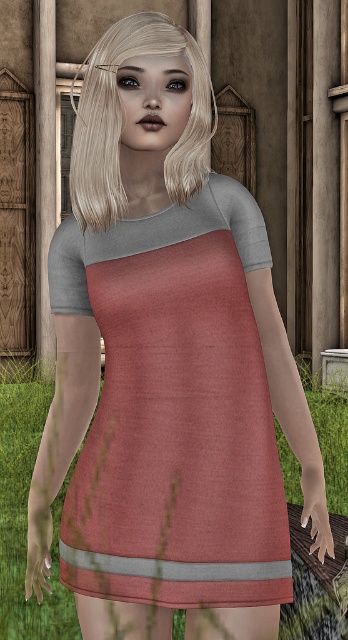
Which is behind, point (264, 420) or point (12, 612)?

Point (12, 612)

Which is in front, point (182, 472) or point (323, 444)?

Point (182, 472) is in front.

You are a GUI agent. You are given a task and a screenshot of the screen. Output one action in this format:
    pyautogui.click(x=<x>, y=<y>)
    Task: Click on the matte pink fabric dress at center
    This screenshot has width=348, height=640.
    Given the screenshot: What is the action you would take?
    pyautogui.click(x=177, y=436)

Is green grass at lower center to the left of matte gray fabric at center from the viewer's perspective?

Yes, green grass at lower center is to the left of matte gray fabric at center.

Is green grass at lower center below matte gray fabric at center?

Indeed, green grass at lower center is positioned under matte gray fabric at center.

Which is in front, point (26, 632) or point (83, 273)?

Point (83, 273) is in front.

Identify the location of green grass at lower center. This screenshot has width=348, height=640. (26, 509).

Is point (67, 516) farther from camera compared to point (131, 237)?

Yes, it is behind point (131, 237).

Between matte pink fabric dress at center and matte gray fabric at center, which one has less height?

With less height is matte gray fabric at center.

Does point (186, 552) lie in front of point (67, 304)?

Yes.

Image resolution: width=348 pixels, height=640 pixels. I want to click on matte pink fabric dress at center, so click(x=177, y=436).